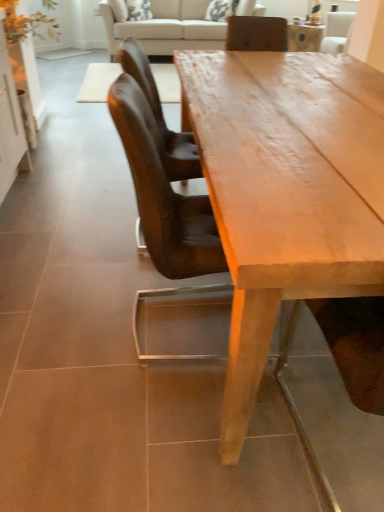
Question: Which direction should I rotate to face leather chair at center, positioned as the 1th chair in back-to-front order, — up or down?

Choices:
 (A) down
 (B) up

Answer: (B)

Question: Does beige fabric couch at upper center have a larger size compared to white glossy cabinet at left?

Choices:
 (A) no
 (B) yes

Answer: (B)

Question: Is beige fabric couch at upper center to the left of white glossy cabinet at left from the viewer's perspective?

Choices:
 (A) no
 (B) yes

Answer: (A)

Question: Is beige fabric couch at upper center not close to white glossy cabinet at left?

Choices:
 (A) yes
 (B) no

Answer: (A)

Question: Is the surface of beige fabric couch at upper center in direct contact with white glossy cabinet at left?

Choices:
 (A) yes
 (B) no

Answer: (B)

Question: Can you confirm if beige fabric couch at upper center is taller than white glossy cabinet at left?

Choices:
 (A) no
 (B) yes

Answer: (A)

Question: Is beige fabric couch at upper center facing away from white glossy cabinet at left?

Choices:
 (A) yes
 (B) no

Answer: (B)

Question: Is brown leather chair at center, which is counted as the 1th chair, starting from the front, to the left of smooth wooden table at center from the viewer's perspective?

Choices:
 (A) no
 (B) yes

Answer: (B)

Question: Can you confirm if brown leather chair at center, marked as the second chair in a back-to-front arrangement, is thinner than smooth wooden table at center?

Choices:
 (A) no
 (B) yes

Answer: (B)

Question: From a real-world perspective, is brown leather chair at center, which is counted as the 1th chair, starting from the front, positioned over smooth wooden table at center based on gravity?

Choices:
 (A) no
 (B) yes

Answer: (B)

Question: From a real-world perspective, is brown leather chair at center, which is counted as the 1th chair, starting from the front, below smooth wooden table at center?

Choices:
 (A) yes
 (B) no

Answer: (B)

Question: Can you confirm if brown leather chair at center, which is counted as the 1th chair, starting from the front, is smaller than smooth wooden table at center?

Choices:
 (A) no
 (B) yes

Answer: (B)

Question: From a real-world perspective, is leather chair at center, which appears as the 2th chair when viewed from the front, below smooth wooden table at center?

Choices:
 (A) no
 (B) yes

Answer: (A)